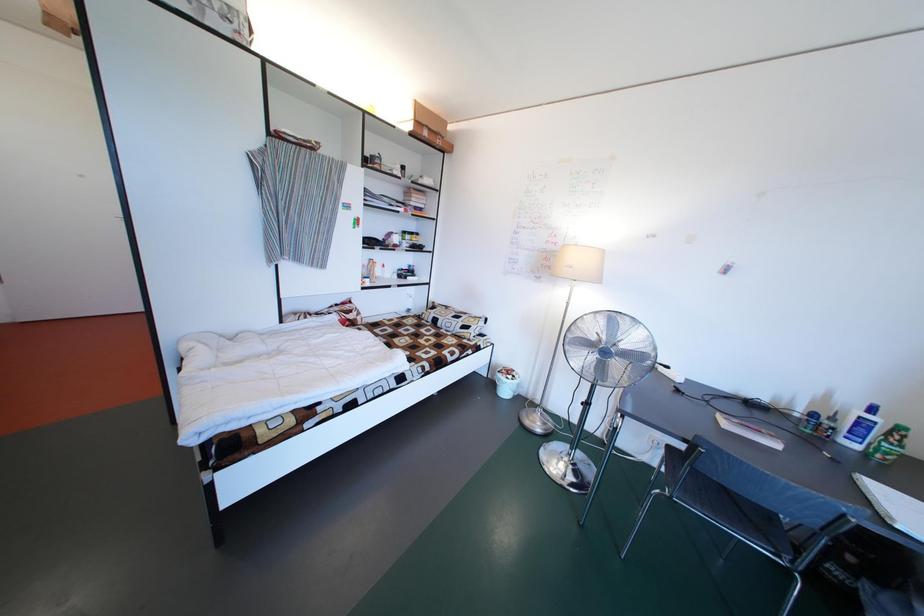
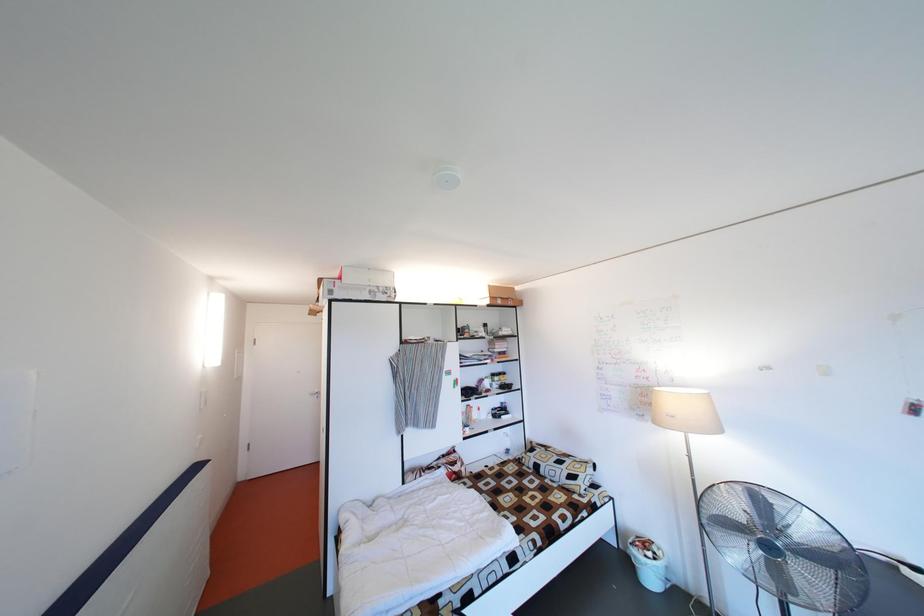
Based on the continuous images, in which direction is the camera rotating?

The camera's rotation is toward left-up.